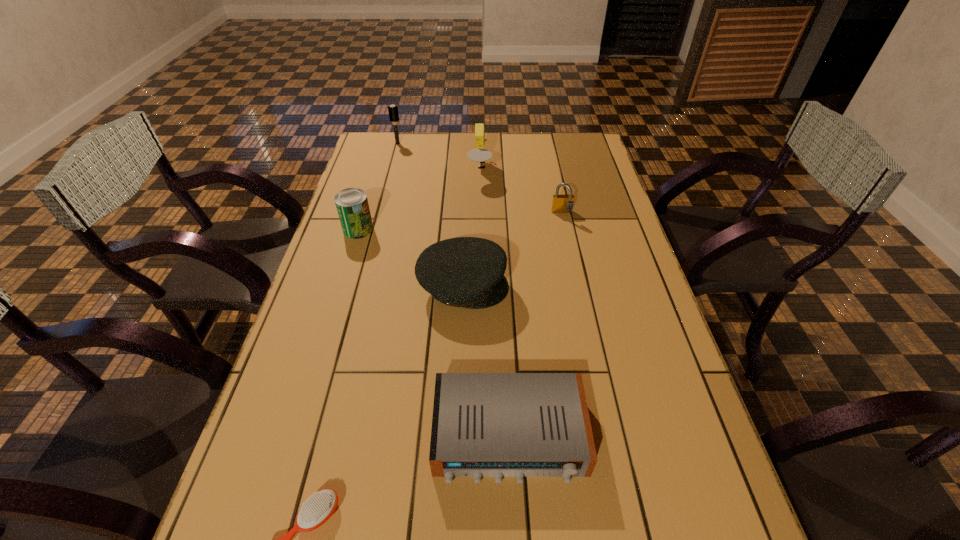
Where is `the farthest object`? the farthest object is located at coordinates (393, 112).

Where is `the farther hairbrush`? The image size is (960, 540). the farther hairbrush is located at coordinates (393, 112).

Identify the location of the second farthest object. (479, 154).

Locate an element on the screen. The image size is (960, 540). the fourth nearest object is located at coordinates (352, 205).

Identify the location of the rightmost object. The width and height of the screenshot is (960, 540). (563, 203).

Find the location of `the fifth nearest object`. the fifth nearest object is located at coordinates (563, 203).

Identify the location of beret. (468, 272).

What are the coordinates of `the second nearest object` in the screenshot? It's located at coord(498,425).

Locate an element on the screen. The height and width of the screenshot is (540, 960). radio receiver is located at coordinates (498, 425).

Image resolution: width=960 pixels, height=540 pixels. Find the location of `free space located on the front of the farther hairbrush`. free space located on the front of the farther hairbrush is located at coordinates (392, 164).